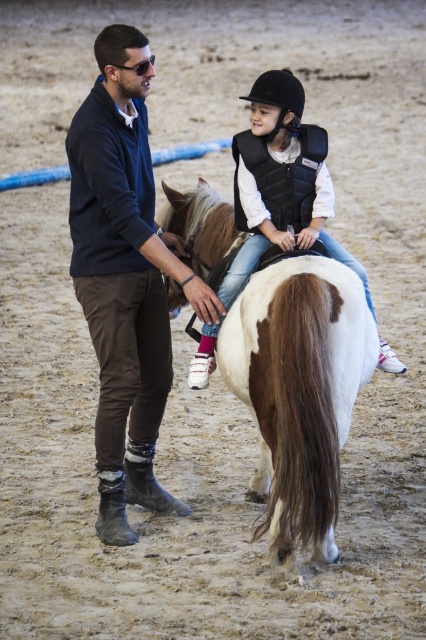
Which is below, white glossy horse at center or white matte vest at center?

white glossy horse at center is below.

Does white glossy horse at center have a greater height compared to white matte vest at center?

In fact, white glossy horse at center may be shorter than white matte vest at center.

Who is more distant from viewer, [321,365] or [340,248]?

The point [340,248] is more distant.

Where is `white glossy horse at center`? The height and width of the screenshot is (640, 426). white glossy horse at center is located at coordinates (299, 390).

Is dark blue sweater at center to the left of white matte vest at center from the viewer's perspective?

Correct, you'll find dark blue sweater at center to the left of white matte vest at center.

What do you see at coordinates (124, 276) in the screenshot? The width and height of the screenshot is (426, 640). I see `dark blue sweater at center` at bounding box center [124, 276].

I want to click on dark blue sweater at center, so click(124, 276).

Which of these two, dark blue sweater at center or white glossy horse at center, stands taller?

dark blue sweater at center is taller.

Can you confirm if dark blue sweater at center is positioned above white glossy horse at center?

Yes, dark blue sweater at center is above white glossy horse at center.

Who is more forward, (x=94, y=342) or (x=278, y=387)?

Point (x=278, y=387)

Find the location of a particular element. dark blue sweater at center is located at coordinates (124, 276).